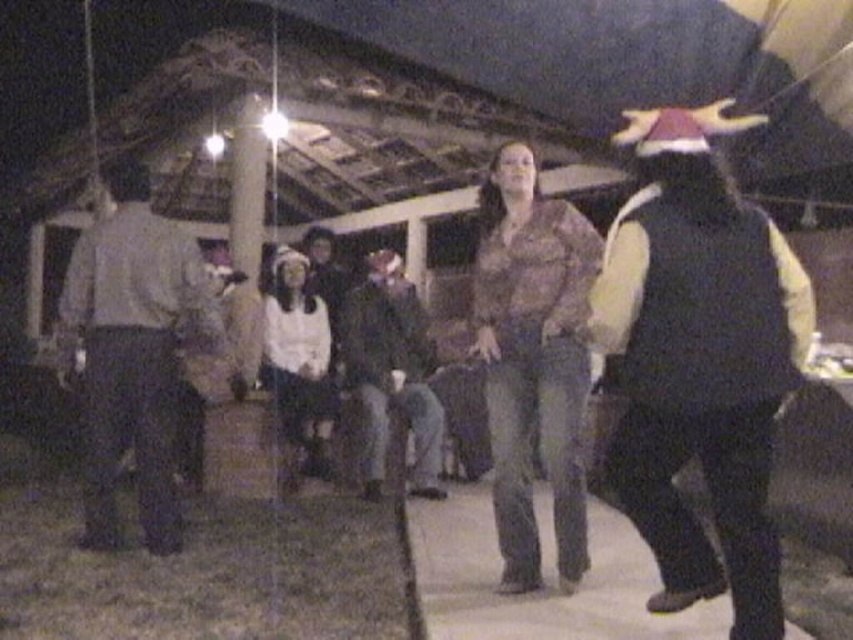
Who is taller, light brown leather jacket at left or dark gray jeans at center?

light brown leather jacket at left is taller.

Which is above, light brown leather jacket at left or dark gray jeans at center?

Positioned higher is light brown leather jacket at left.

The height and width of the screenshot is (640, 853). What do you see at coordinates (131, 353) in the screenshot? I see `light brown leather jacket at left` at bounding box center [131, 353].

Find the location of a particular element. The image size is (853, 640). light brown leather jacket at left is located at coordinates (131, 353).

Between dark gray vest at right and dark gray jeans at center, which one has less height?

dark gray vest at right

Can you confirm if dark gray vest at right is positioned below dark gray jeans at center?

Actually, dark gray vest at right is above dark gray jeans at center.

This screenshot has height=640, width=853. Identify the location of dark gray vest at right. (700, 360).

Identify the location of dark gray vest at right. (700, 360).

Is dark gray vest at right smaller than light brown leather jacket at left?

Yes, dark gray vest at right is smaller than light brown leather jacket at left.

Image resolution: width=853 pixels, height=640 pixels. I want to click on dark gray vest at right, so click(700, 360).

Identify the location of dark gray vest at right. This screenshot has height=640, width=853. (700, 360).